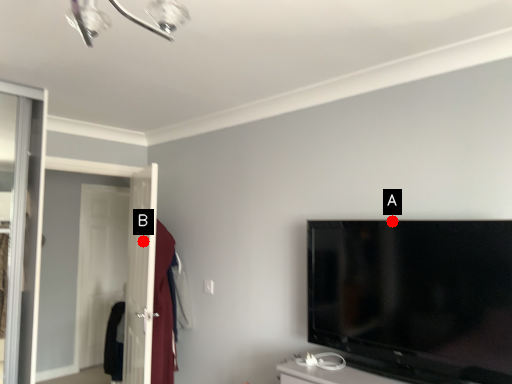
Question: Two points are circled on the image, labeled by A and B beside each circle. Which point is further to the camera?

Choices:
 (A) A is further
 (B) B is further

Answer: (B)